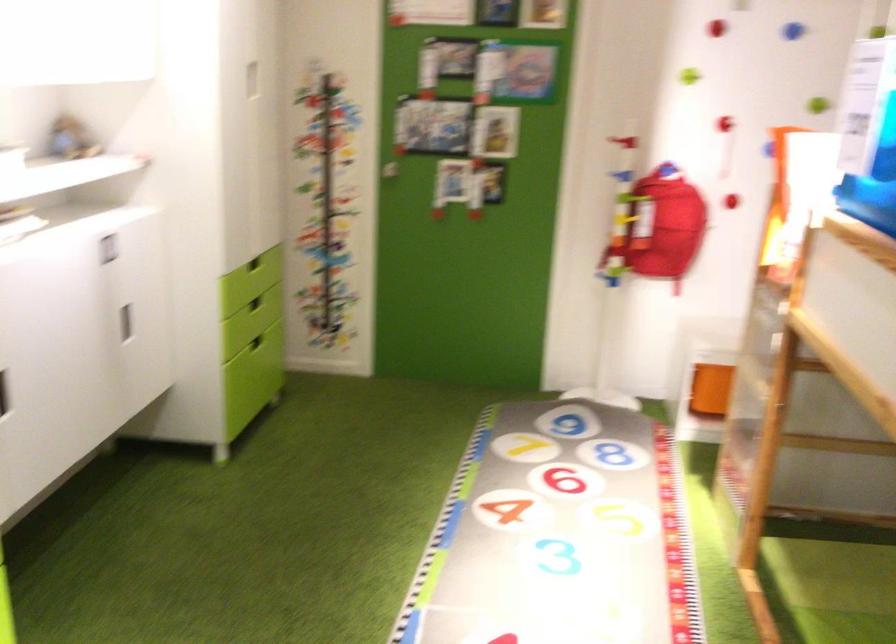
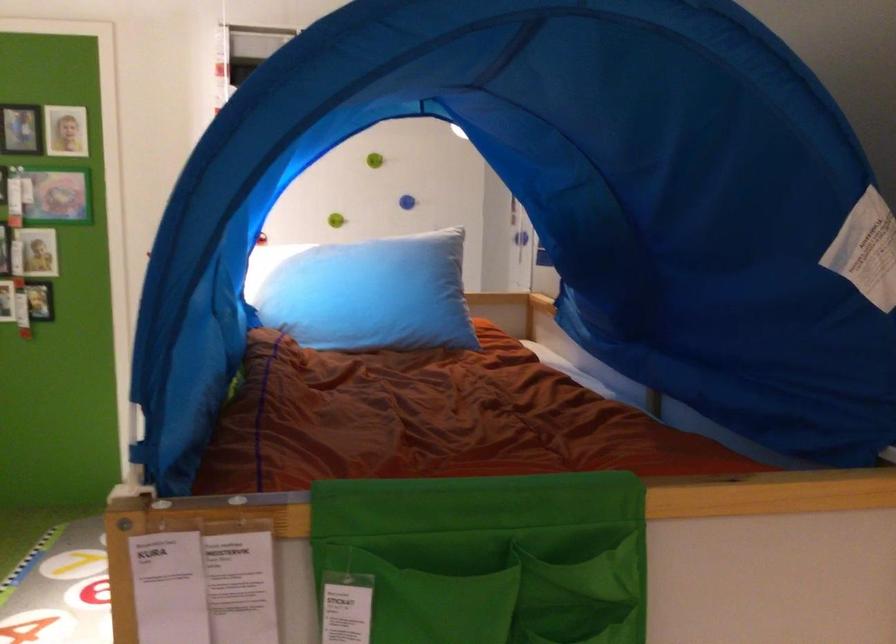
Question: I am providing you with two images of the same scene from different viewpoints. Which of the following objects are not visible in image2?

Choices:
 (A) light blue pillow
 (B) green wall knob
 (C) red climbing hold
 (D) cabinet handle

Answer: (C)